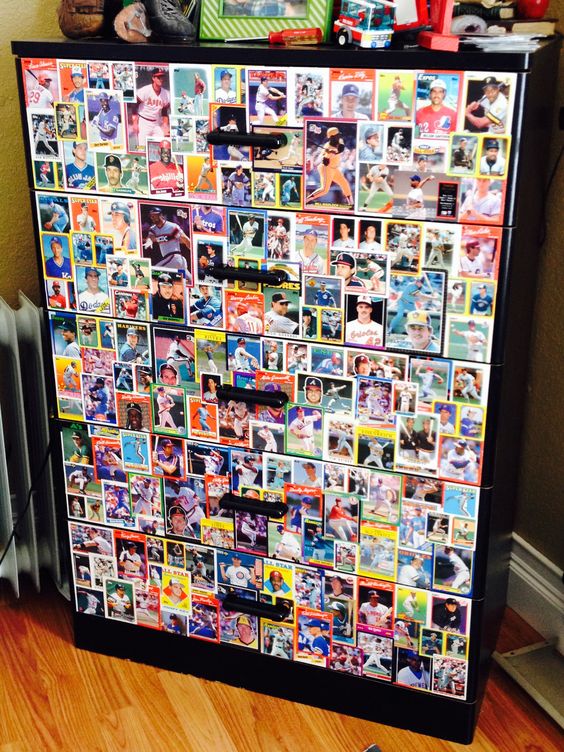
Where is `heater`? This screenshot has height=752, width=564. heater is located at coordinates (39, 387).